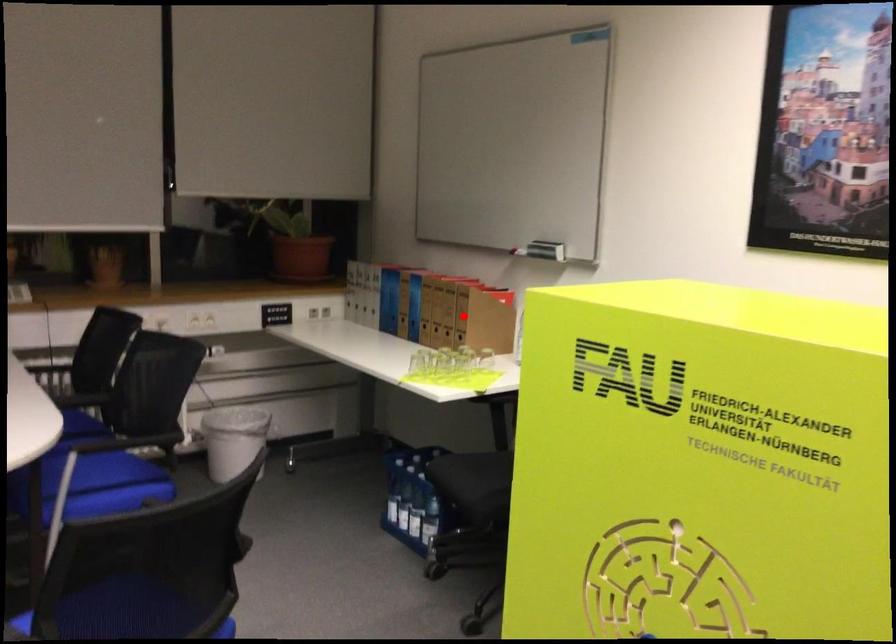
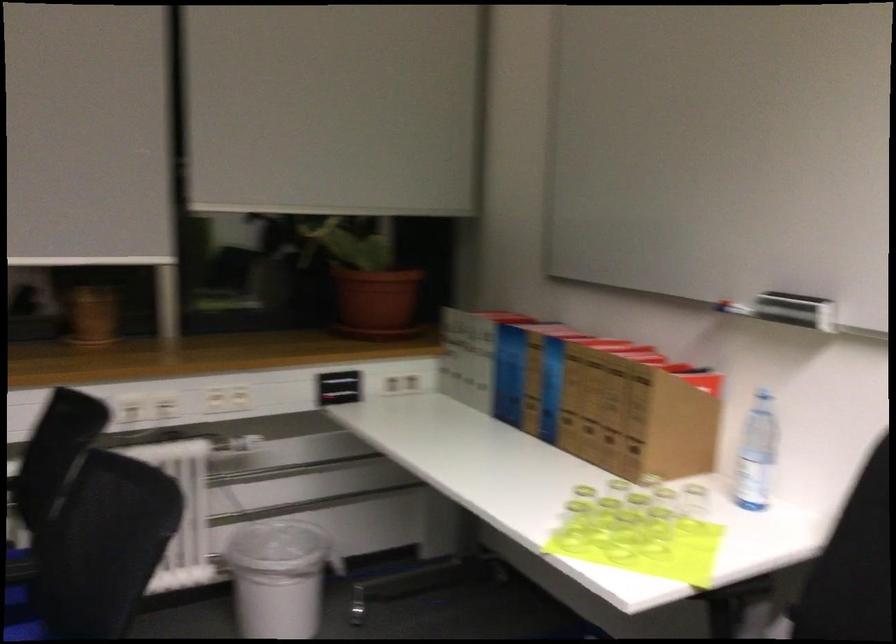
In the second image, find the point that corresponds to the highlighted location in the first image.

(634, 417)